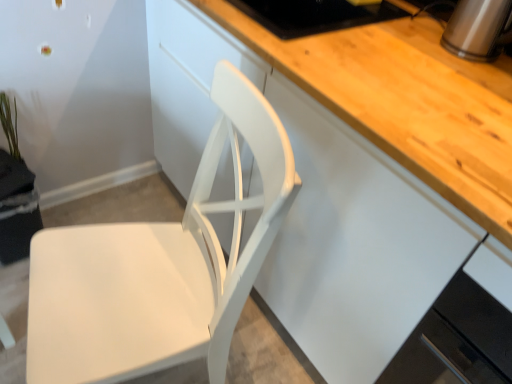
Question: Does white matte cabinet at center, which appears as the 1th cabinetry when viewed from the top, appear on the left side of satin silver kettle at upper right?

Choices:
 (A) no
 (B) yes

Answer: (B)

Question: Considering the relative sizes of white matte cabinet at center, which appears as the 1th cabinetry when viewed from the top, and satin silver kettle at upper right in the image provided, is white matte cabinet at center, which appears as the 1th cabinetry when viewed from the top, smaller than satin silver kettle at upper right?

Choices:
 (A) no
 (B) yes

Answer: (A)

Question: Can you confirm if white matte cabinet at center, the second cabinetry when ordered from bottom to top, is shorter than satin silver kettle at upper right?

Choices:
 (A) no
 (B) yes

Answer: (A)

Question: Does white matte cabinet at center, the second cabinetry when ordered from bottom to top, have a greater width compared to satin silver kettle at upper right?

Choices:
 (A) yes
 (B) no

Answer: (A)

Question: Can you confirm if white matte cabinet at center, which appears as the 1th cabinetry when viewed from the top, is positioned to the right of satin silver kettle at upper right?

Choices:
 (A) no
 (B) yes

Answer: (A)

Question: From a real-world perspective, is white glossy cabinet at lower right, the 1th cabinetry ordered from the bottom, physically located above or below satin silver kettle at upper right?

Choices:
 (A) above
 (B) below

Answer: (B)

Question: Is white glossy cabinet at lower right, which ranks as the 2th cabinetry in top-to-bottom order, in front of or behind satin silver kettle at upper right in the image?

Choices:
 (A) front
 (B) behind

Answer: (A)

Question: From the image's perspective, is white glossy cabinet at lower right, which ranks as the 2th cabinetry in top-to-bottom order, located above or below satin silver kettle at upper right?

Choices:
 (A) below
 (B) above

Answer: (A)

Question: Based on their positions, is white glossy cabinet at lower right, the 1th cabinetry ordered from the bottom, located to the left or right of satin silver kettle at upper right?

Choices:
 (A) left
 (B) right

Answer: (B)

Question: Considering the positions of green matte plant at upper left and white matte cabinet at center, which appears as the 1th cabinetry when viewed from the top, in the image, is green matte plant at upper left wider or thinner than white matte cabinet at center, which appears as the 1th cabinetry when viewed from the top,?

Choices:
 (A) thin
 (B) wide

Answer: (A)

Question: Considering the positions of green matte plant at upper left and white matte cabinet at center, which appears as the 1th cabinetry when viewed from the top, in the image, is green matte plant at upper left bigger or smaller than white matte cabinet at center, which appears as the 1th cabinetry when viewed from the top,?

Choices:
 (A) big
 (B) small

Answer: (B)

Question: From the image's perspective, is green matte plant at upper left positioned above or below white matte cabinet at center, the second cabinetry when ordered from bottom to top?

Choices:
 (A) above
 (B) below

Answer: (A)

Question: Is green matte plant at upper left to the left or to the right of white matte cabinet at center, the second cabinetry when ordered from bottom to top, in the image?

Choices:
 (A) left
 (B) right

Answer: (A)

Question: Considering the positions of green matte plant at upper left and white glossy cabinet at lower right, the 1th cabinetry ordered from the bottom, in the image, is green matte plant at upper left wider or thinner than white glossy cabinet at lower right, the 1th cabinetry ordered from the bottom,?

Choices:
 (A) wide
 (B) thin

Answer: (B)

Question: Considering the positions of point (18, 155) and point (480, 362), is point (18, 155) closer or farther from the camera than point (480, 362)?

Choices:
 (A) closer
 (B) farther

Answer: (B)